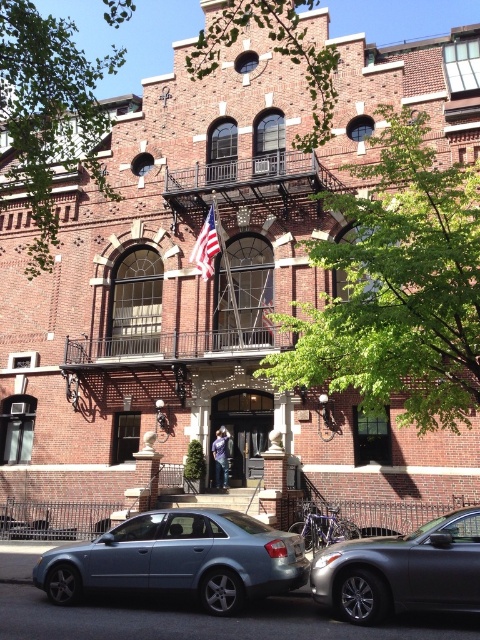
Can you confirm if satin blue sedan at lower center is positioned to the right of metallic gray sedan at lower right?

Incorrect, satin blue sedan at lower center is not on the right side of metallic gray sedan at lower right.

Does satin blue sedan at lower center come in front of metallic gray sedan at lower right?

No, it is not.

Find the location of a particular element. satin blue sedan at lower center is located at coordinates (180, 560).

Is metallic gray sedan at lower right wider than american flag at center?

Yes.

Is point (474, 509) positioned behind point (203, 230)?

No.

I want to click on metallic gray sedan at lower right, so click(403, 570).

Is satin blue sedan at lower center thinner than american flag at center?

Incorrect, satin blue sedan at lower center's width is not less than american flag at center's.

Who is taller, satin blue sedan at lower center or american flag at center?

satin blue sedan at lower center

What do you see at coordinates (180, 560) in the screenshot? The height and width of the screenshot is (640, 480). I see `satin blue sedan at lower center` at bounding box center [180, 560].

The height and width of the screenshot is (640, 480). Identify the location of satin blue sedan at lower center. (180, 560).